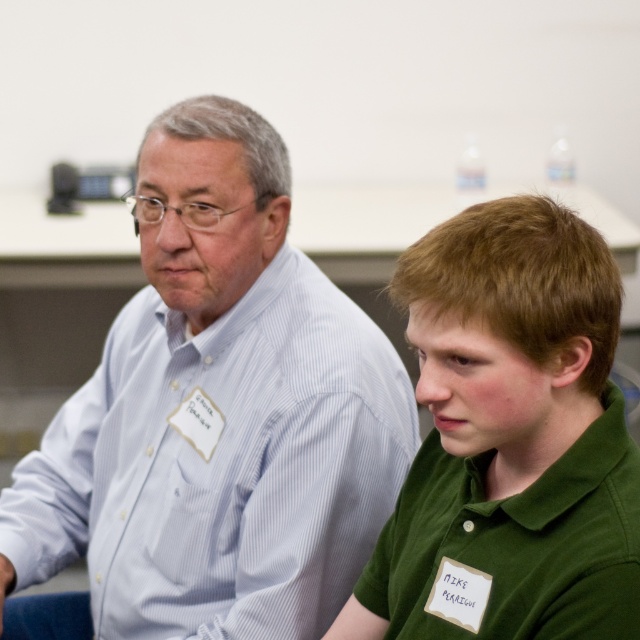
You are organizing a clothing donation drive and need to categorize shirts by size. You have two shirts in front of you, the light blue striped shirt at left and the green matte shirt at right. Which shirt should you place in the larger size bin?

The light blue striped shirt at left is bigger than the green matte shirt at right, so you should place the light blue striped shirt at left in the larger size bin.

You are a photographer at an event and need to arrange the two people in the image so that the light blue striped shirt at left is positioned to the right of the green matte shirt at right. Is this possible without moving either individual?

The light blue striped shirt at left is currently to the left of the green matte shirt at right, so to position it to the right would require moving the individuals, which is not possible without moving them. Therefore, it is not possible to achieve this arrangement without moving either individual.